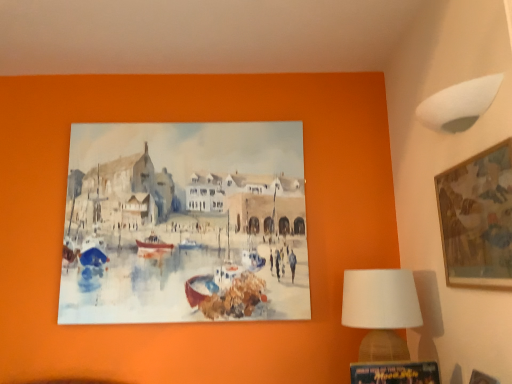
Question: Is white fabric lampshade at upper right looking in the opposite direction of wooden picture frame at lower right, marked as the 1th picture frame in a left-to-right arrangement?

Choices:
 (A) no
 (B) yes

Answer: (A)

Question: Is white fabric lampshade at upper right to the right of wooden picture frame at lower right, marked as the 1th picture frame in a left-to-right arrangement, from the viewer's perspective?

Choices:
 (A) yes
 (B) no

Answer: (A)

Question: From the image's perspective, does white fabric lampshade at upper right appear lower than wooden picture frame at lower right, marked as the 1th picture frame in a left-to-right arrangement?

Choices:
 (A) no
 (B) yes

Answer: (A)

Question: Is white fabric lampshade at upper right smaller than wooden picture frame at lower right, marked as the 1th picture frame in a left-to-right arrangement?

Choices:
 (A) no
 (B) yes

Answer: (A)

Question: Is white fabric lampshade at upper right not close to wooden picture frame at lower right, which is the first picture frame from bottom to top?

Choices:
 (A) yes
 (B) no

Answer: (B)

Question: From a real-world perspective, is white fabric lampshade at upper right over wooden picture frame at lower right, the 2th picture frame in the right-to-left sequence?

Choices:
 (A) yes
 (B) no

Answer: (A)

Question: Is the position of white fabric lampshade at lower right more distant than that of white fabric lampshade at upper right?

Choices:
 (A) no
 (B) yes

Answer: (B)

Question: Considering the relative positions of white fabric lampshade at lower right and white fabric lampshade at upper right in the image provided, is white fabric lampshade at lower right in front of white fabric lampshade at upper right?

Choices:
 (A) yes
 (B) no

Answer: (B)

Question: Is white fabric lampshade at lower right located outside white fabric lampshade at upper right?

Choices:
 (A) no
 (B) yes

Answer: (B)

Question: Is white fabric lampshade at lower right taller than white fabric lampshade at upper right?

Choices:
 (A) yes
 (B) no

Answer: (A)

Question: Are white fabric lampshade at lower right and white fabric lampshade at upper right located far from each other?

Choices:
 (A) yes
 (B) no

Answer: (B)

Question: Is white fabric lampshade at lower right bigger than white fabric lampshade at upper right?

Choices:
 (A) no
 (B) yes

Answer: (B)

Question: Is white fabric lampshade at upper right turned away from white fabric lampshade at lower right?

Choices:
 (A) yes
 (B) no

Answer: (B)